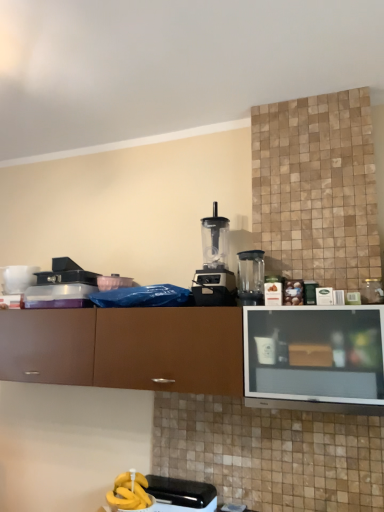
Question: Is transparent plastic blender at center, the first kitchen appliance when ordered from right to left, positioned beyond the bounds of white glossy mug at upper left, which is the 2th appliance in right-to-left order?

Choices:
 (A) no
 (B) yes

Answer: (B)

Question: From the image's perspective, is transparent plastic blender at center, the first kitchen appliance when ordered from right to left, on top of white glossy mug at upper left, which is the 2th appliance in right-to-left order?

Choices:
 (A) yes
 (B) no

Answer: (A)

Question: Can you confirm if transparent plastic blender at center, which is counted as the second kitchen appliance, starting from the left, is thinner than white glossy mug at upper left, which is counted as the 2th appliance, starting from the front?

Choices:
 (A) no
 (B) yes

Answer: (B)

Question: Is transparent plastic blender at center, which is counted as the second kitchen appliance, starting from the left, closer to camera compared to white glossy mug at upper left, which is counted as the 2th appliance, starting from the front?

Choices:
 (A) yes
 (B) no

Answer: (A)

Question: From the image's perspective, does transparent plastic blender at center, the first kitchen appliance when ordered from right to left, appear lower than white glossy mug at upper left, marked as the 1th appliance in a top-to-bottom arrangement?

Choices:
 (A) no
 (B) yes

Answer: (A)

Question: Considering the relative positions of transparent plastic blender at center, which is counted as the second kitchen appliance, starting from the left, and white glossy mug at upper left, the 2th appliance when ordered from bottom to top, in the image provided, is transparent plastic blender at center, which is counted as the second kitchen appliance, starting from the left, to the left of white glossy mug at upper left, the 2th appliance when ordered from bottom to top, from the viewer's perspective?

Choices:
 (A) no
 (B) yes

Answer: (A)

Question: Does brown matte cabinet at center have a smaller size compared to white glossy mug at upper left, which is the 2th appliance in right-to-left order?

Choices:
 (A) no
 (B) yes

Answer: (A)

Question: Is brown matte cabinet at center closer to the viewer compared to white glossy mug at upper left, the 1th appliance positioned from the left?

Choices:
 (A) no
 (B) yes

Answer: (B)

Question: From the image's perspective, would you say brown matte cabinet at center is shown under white glossy mug at upper left, the 2th appliance when ordered from bottom to top?

Choices:
 (A) yes
 (B) no

Answer: (A)

Question: Is brown matte cabinet at center not within white glossy mug at upper left, which is counted as the 2th appliance, starting from the front?

Choices:
 (A) yes
 (B) no

Answer: (A)

Question: Is brown matte cabinet at center oriented towards white glossy mug at upper left, the 2th appliance when ordered from bottom to top?

Choices:
 (A) yes
 (B) no

Answer: (B)

Question: Would you say white glossy mug at upper left, acting as the 1th appliance starting from the back, is part of brown matte cabinet at center's contents?

Choices:
 (A) yes
 (B) no

Answer: (B)

Question: Would you say white glossy mug at upper left, the 2th appliance when ordered from bottom to top, is part of black plastic toaster at lower center, positioned as the 1th appliance in bottom-to-top order,'s contents?

Choices:
 (A) yes
 (B) no

Answer: (B)